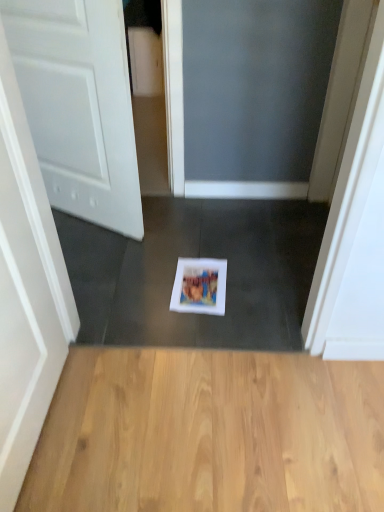
Question: Can you confirm if white paper at center is taller than light brown wood flooring at center?

Choices:
 (A) no
 (B) yes

Answer: (A)

Question: Does white paper at center appear on the left side of light brown wood flooring at center?

Choices:
 (A) yes
 (B) no

Answer: (A)

Question: From the image's perspective, is white paper at center beneath light brown wood flooring at center?

Choices:
 (A) yes
 (B) no

Answer: (B)

Question: Does white paper at center come in front of light brown wood flooring at center?

Choices:
 (A) no
 (B) yes

Answer: (A)

Question: Is white paper at center not near light brown wood flooring at center?

Choices:
 (A) no
 (B) yes

Answer: (A)

Question: From a real-world perspective, is light brown wood flooring at center physically located above or below white paper at center?

Choices:
 (A) above
 (B) below

Answer: (B)

Question: In the image, is light brown wood flooring at center positioned in front of or behind white paper at center?

Choices:
 (A) behind
 (B) front

Answer: (B)

Question: From the image's perspective, is light brown wood flooring at center located above or below white paper at center?

Choices:
 (A) above
 (B) below

Answer: (B)

Question: In terms of height, does light brown wood flooring at center look taller or shorter compared to white paper at center?

Choices:
 (A) short
 (B) tall

Answer: (B)

Question: In terms of height, does white paper at center look taller or shorter compared to white matte door at left?

Choices:
 (A) short
 (B) tall

Answer: (A)

Question: Would you say white paper at center is to the left or to the right of white matte door at left in the picture?

Choices:
 (A) right
 (B) left

Answer: (A)

Question: Which is correct: white paper at center is inside white matte door at left, or outside of it?

Choices:
 (A) inside
 (B) outside

Answer: (B)

Question: From the image's perspective, is white paper at center above or below white matte door at left?

Choices:
 (A) above
 (B) below

Answer: (B)

Question: From a real-world perspective, is white matte door at left physically located above or below white paper at center?

Choices:
 (A) below
 (B) above

Answer: (B)

Question: Would you say white matte door at left is to the left or to the right of white paper at center in the picture?

Choices:
 (A) left
 (B) right

Answer: (A)